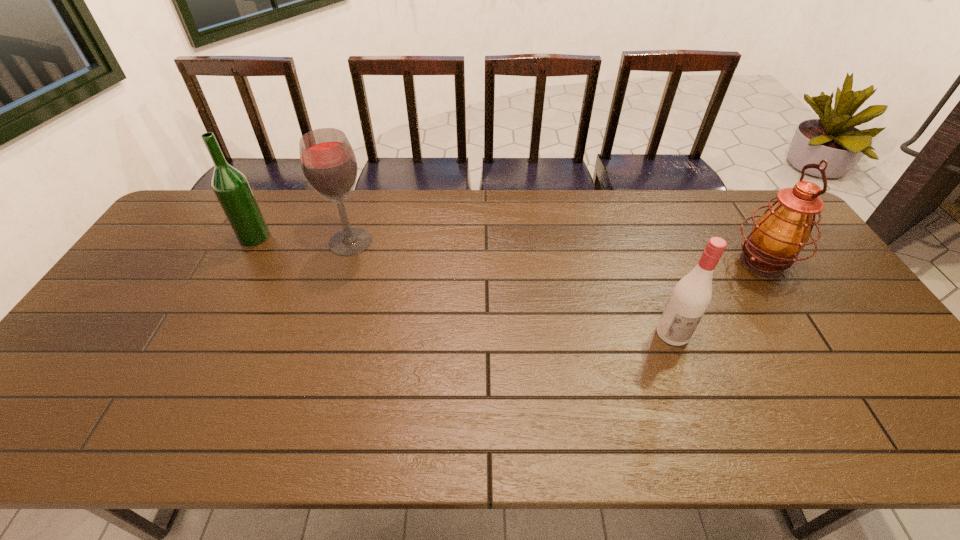
Find the location of `the second object from left to right`. the second object from left to right is located at coordinates (328, 162).

I want to click on the leftmost alcohol, so click(231, 187).

Where is `oil lamp`? The height and width of the screenshot is (540, 960). oil lamp is located at coordinates (783, 230).

Image resolution: width=960 pixels, height=540 pixels. I want to click on the nearest alcohol, so click(691, 296).

Locate an element on the screen. the rightmost alcohol is located at coordinates (691, 296).

You are a GUI agent. You are given a task and a screenshot of the screen. Output one action in this format:
    pyautogui.click(x=<x>, y=<y>)
    Task: Click on the vacant space located on the left of the second alcohol from left to right
    This screenshot has width=960, height=540.
    Given the screenshot: What is the action you would take?
    coord(312,241)

Locate an element on the screen. The image size is (960, 540). vacant space located 0.340m on the front of the leftmost object is located at coordinates (202, 334).

I want to click on vacant space positioned 0.180m on the left of the rightmost object, so click(x=668, y=264).

Where is `vacant space situated 0.160m on the label of the rightmost alcohol`? vacant space situated 0.160m on the label of the rightmost alcohol is located at coordinates (700, 405).

Where is `object situated at the right edge`? The height and width of the screenshot is (540, 960). object situated at the right edge is located at coordinates (783, 230).